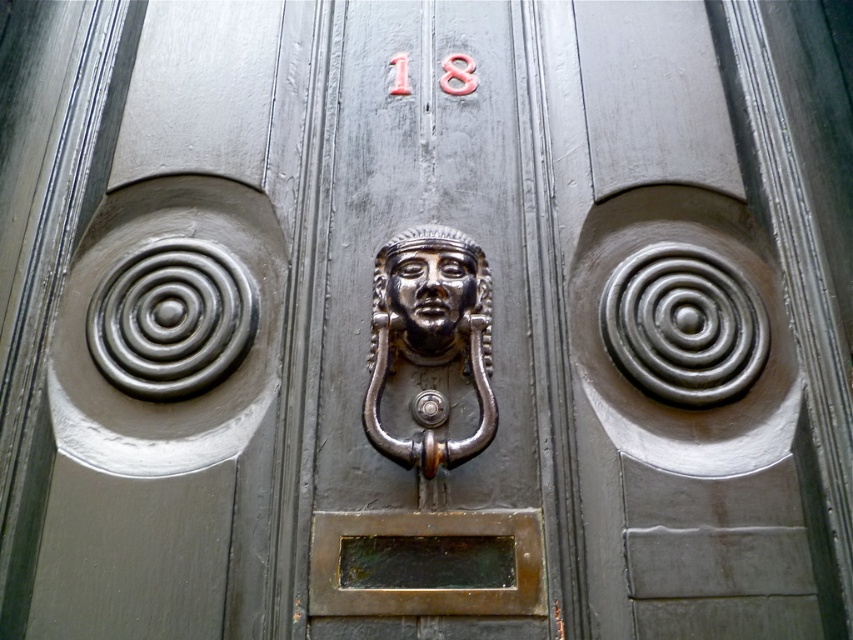
Question: Which of these objects is positioned farthest from the polished bronze head at center?

Choices:
 (A) polished bronze face at center
 (B) red painted number at center
 (C) polished silver door knocker at center

Answer: (B)

Question: Which of the following is the farthest from the observer?

Choices:
 (A) polished bronze head at center
 (B) red painted number at center
 (C) polished silver door knocker at center

Answer: (B)

Question: Which object is the closest to the polished bronze head at center?

Choices:
 (A) red painted number at center
 (B) polished silver door knocker at center

Answer: (B)

Question: Can you confirm if red painted number at center is bigger than polished silver door knocker at center?

Choices:
 (A) no
 (B) yes

Answer: (B)

Question: Does polished bronze head at center appear over polished bronze face at center?

Choices:
 (A) yes
 (B) no

Answer: (B)

Question: Does polished bronze head at center appear over polished silver door knocker at center?

Choices:
 (A) yes
 (B) no

Answer: (A)